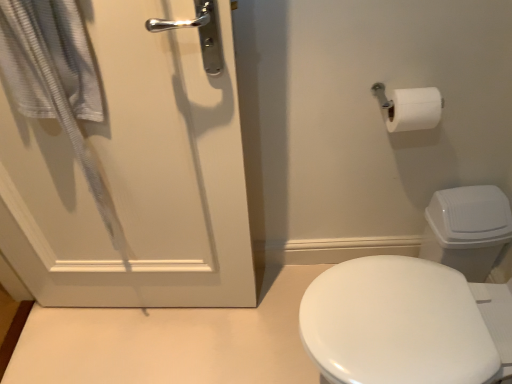
Find the location of `vacant region below white textured towel at left (from a real-world perspective)`. vacant region below white textured towel at left (from a real-world perspective) is located at coordinates (141, 332).